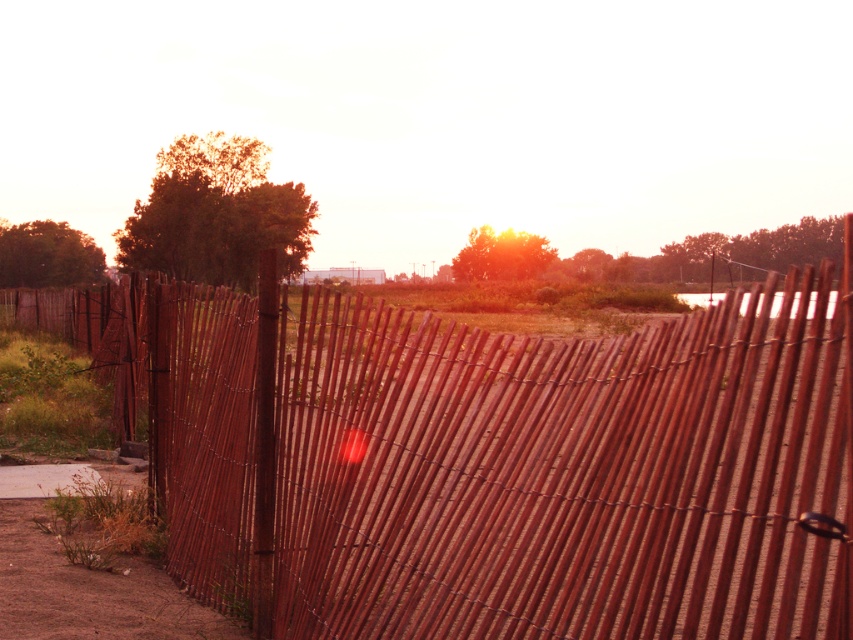
Question: Can you confirm if wooden fence at center is bigger than brown sandy dirt track at lower left?

Choices:
 (A) yes
 (B) no

Answer: (A)

Question: Can you confirm if wooden fence at center is smaller than brown sandy dirt track at lower left?

Choices:
 (A) no
 (B) yes

Answer: (A)

Question: Which point is farther from the camera taking this photo?

Choices:
 (A) (125, 481)
 (B) (370, 394)

Answer: (A)

Question: Is wooden fence at center to the right of brown sandy dirt track at lower left from the viewer's perspective?

Choices:
 (A) yes
 (B) no

Answer: (A)

Question: Among these points, which one is farthest from the camera?

Choices:
 (A) (618, 460)
 (B) (103, 474)

Answer: (B)